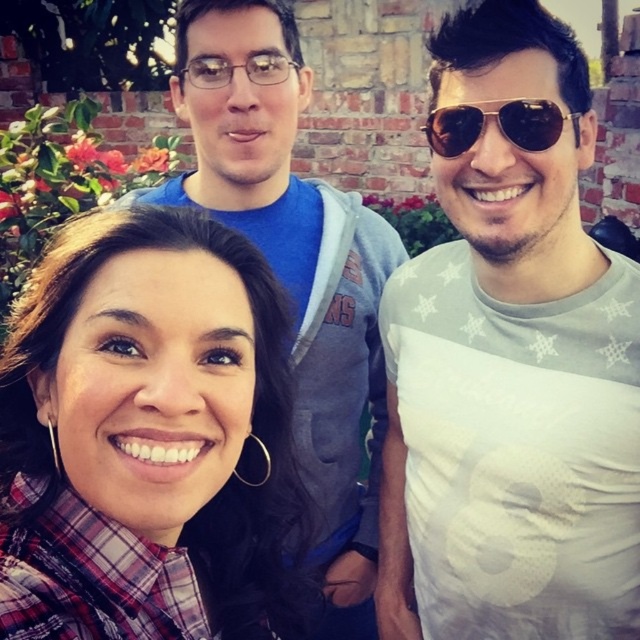
Based on the photo, does matte blue shirt at center appear on the left side of shiny brown aviator sunglasses at upper right?

Correct, you'll find matte blue shirt at center to the left of shiny brown aviator sunglasses at upper right.

Does matte blue shirt at center have a smaller size compared to shiny brown aviator sunglasses at upper right?

No, matte blue shirt at center is not smaller than shiny brown aviator sunglasses at upper right.

Which is behind, point (257, 224) or point (440, 120)?

The point (257, 224) is more distant.

You are a GUI agent. You are given a task and a screenshot of the screen. Output one action in this format:
    pyautogui.click(x=<x>, y=<y>)
    Task: Click on the matte blue shirt at center
    Image resolution: width=640 pixels, height=640 pixels.
    Given the screenshot: What is the action you would take?
    pyautogui.click(x=294, y=268)

Is white matte t-shirt at center bigger than shiny brown aviator sunglasses at upper right?

Indeed, white matte t-shirt at center has a larger size compared to shiny brown aviator sunglasses at upper right.

Is white matte t-shirt at center to the left of shiny brown aviator sunglasses at upper right from the viewer's perspective?

No, white matte t-shirt at center is not to the left of shiny brown aviator sunglasses at upper right.

Is point (513, 310) less distant than point (545, 132)?

No, it is behind (545, 132).

In order to click on white matte t-shirt at center in this screenshot , I will do `click(509, 360)`.

Can you confirm if white matte t-shirt at center is positioned to the left of matte blue shirt at center?

No, white matte t-shirt at center is not to the left of matte blue shirt at center.

In the scene shown: Does white matte t-shirt at center have a greater height compared to matte blue shirt at center?

In fact, white matte t-shirt at center may be shorter than matte blue shirt at center.

Is point (468, 104) positioned before point (355, 380)?

Yes.

At what (x,y) coordinates should I click in order to perform the action: click on white matte t-shirt at center. Please return your answer as a coordinate pair (x, y). The height and width of the screenshot is (640, 640). Looking at the image, I should click on (509, 360).